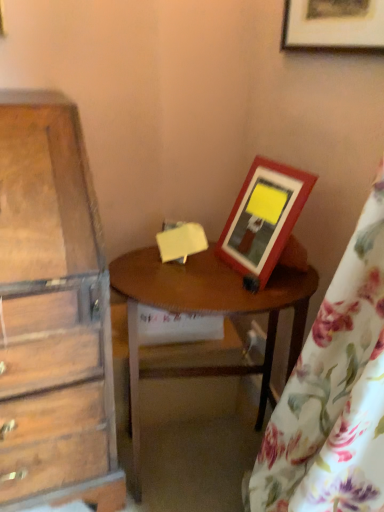
Identify the location of vacant area on top of wooden table at center (from a real-world perspective). The height and width of the screenshot is (512, 384). (191, 274).